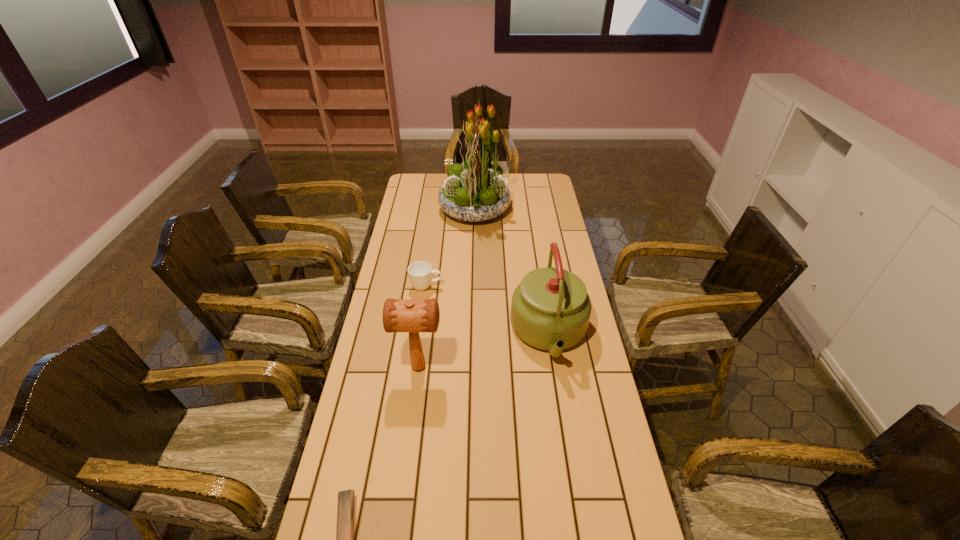
Identify the location of the tallest object. 475,191.

Where is `flower arrangement`? The image size is (960, 540). flower arrangement is located at coordinates (475, 191).

Where is `kettle`? This screenshot has width=960, height=540. kettle is located at coordinates (550, 310).

I want to click on the taller mallet, so click(399, 315).

Find the location of `cup`. cup is located at coordinates (420, 272).

The image size is (960, 540). What are the coordinates of `the second shortest object` in the screenshot? It's located at (420, 272).

The image size is (960, 540). I want to click on free space located 0.050m on the front-facing side of the flower arrangement, so click(520, 208).

Locate an element on the screen. vacant space located at the spout of the kettle is located at coordinates 574,493.

At what (x,y) coordinates should I click in order to perform the action: click on free space located on the strike surface of the taller mallet. Please return your answer as a coordinate pair (x, y). Looking at the image, I should click on (466, 367).

You are a GUI agent. You are given a task and a screenshot of the screen. Output one action in this format:
    pyautogui.click(x=<x>, y=<y>)
    Task: Click on the free location located with the handle on the side of the cup
    This screenshot has height=540, width=960.
    Given the screenshot: What is the action you would take?
    pyautogui.click(x=507, y=287)